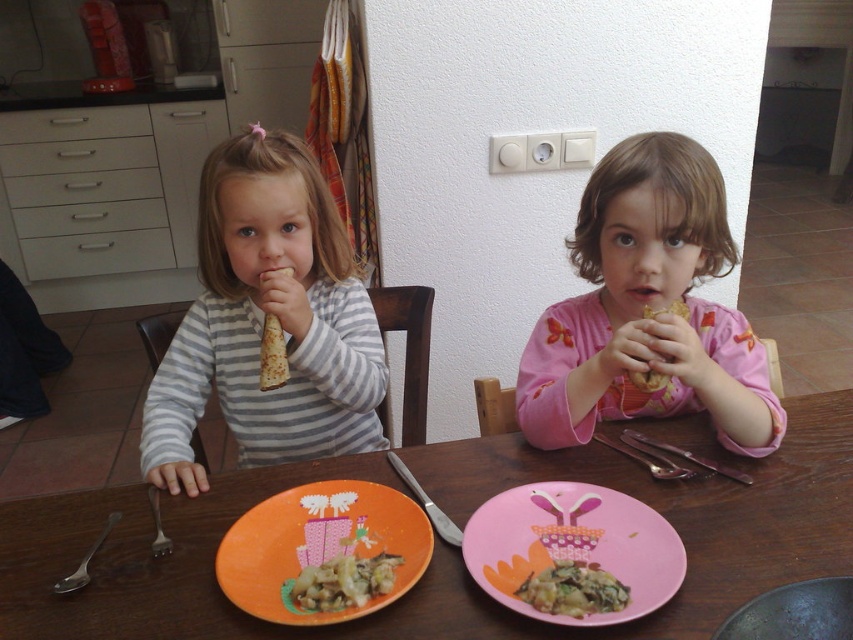
Question: Is pink glossy plate at lower center thinner than silver metallic fork at lower left?

Choices:
 (A) no
 (B) yes

Answer: (A)

Question: Which of these objects is positioned farthest from the pink satin dress at center?

Choices:
 (A) green leafy vegetables at center
 (B) pink glossy plate at lower center

Answer: (A)

Question: Among these points, which one is nearest to the camera?

Choices:
 (A) (643, 374)
 (B) (346, 566)
 (C) (704, 342)
 (D) (239, 145)

Answer: (B)

Question: Can you confirm if wooden table at center is positioned below pink satin dress at center?

Choices:
 (A) yes
 (B) no

Answer: (A)

Question: Among these points, which one is farthest from the camera?

Choices:
 (A) (270, 387)
 (B) (585, 252)

Answer: (B)

Question: In this image, where is striped cotton shirt at center located relative to satin silver fork at lower left?

Choices:
 (A) above
 (B) below

Answer: (A)